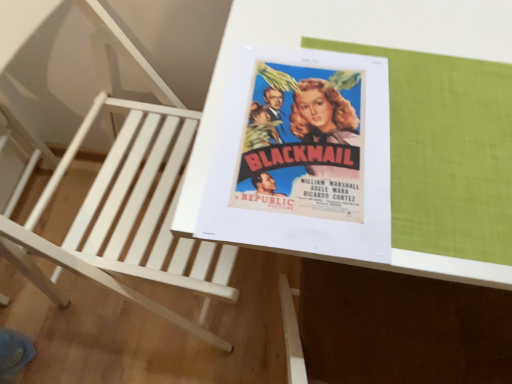
Question: Is white wood chair at upper left to the left or to the right of white glossy table at center in the image?

Choices:
 (A) left
 (B) right

Answer: (A)

Question: Looking at their shapes, would you say white wood chair at upper left is wider or thinner than white glossy table at center?

Choices:
 (A) wide
 (B) thin

Answer: (A)

Question: Which object is the closest to the matte paper poster at center?

Choices:
 (A) white glossy table at center
 (B) white wood chair at upper left

Answer: (A)

Question: Estimate the real-world distances between objects in this image. Which object is closer to the matte paper poster at center?

Choices:
 (A) white glossy table at center
 (B) white wood chair at upper left

Answer: (A)